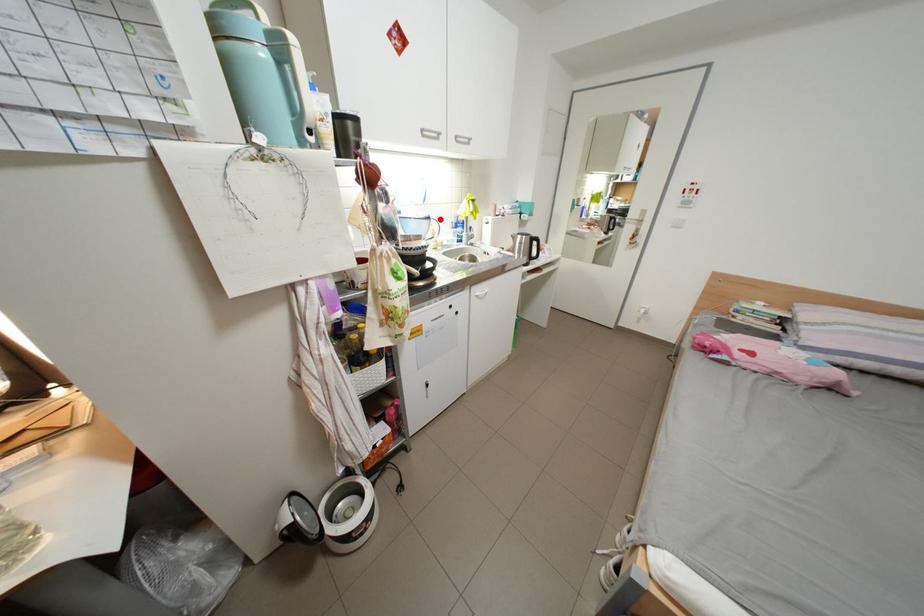
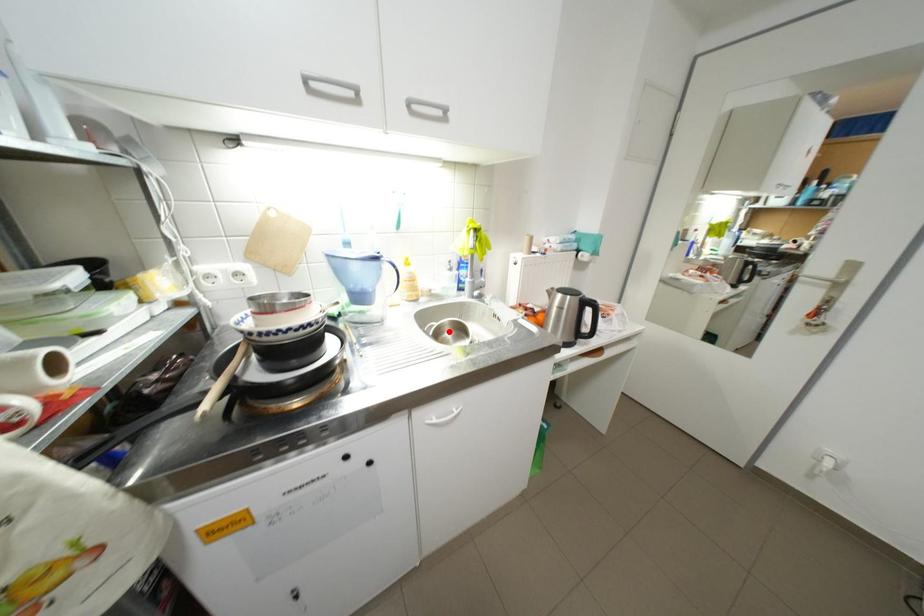
I am providing you with two images of the same scene from different viewpoints. A red point is marked on the first image and another point is marked on the second image. Does the point marked in image1 correspond to the same location as the one in image2?

No